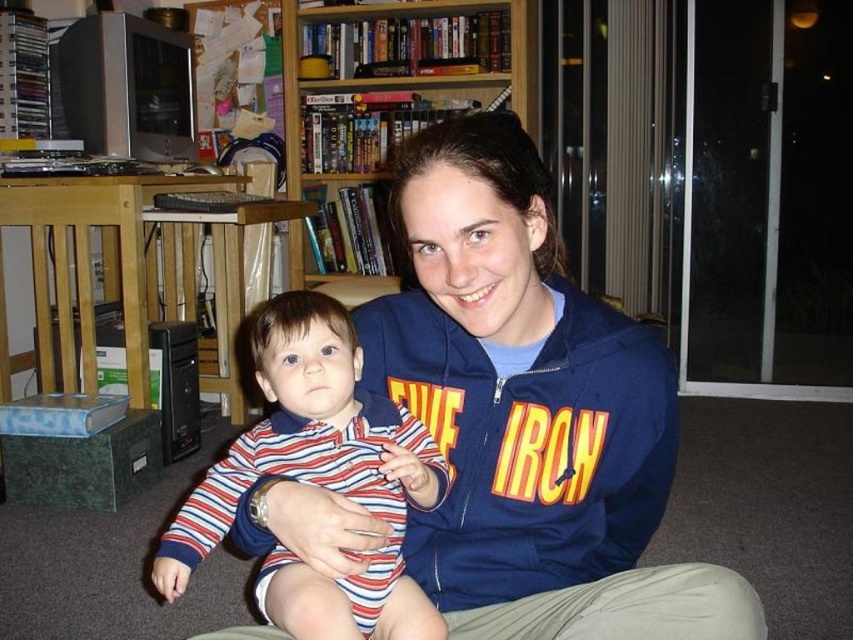
You are a tailor who needs to determine which clothing item requires more fabric based on their widths. The navy blue hoodie at center and the striped cotton onesie at center are both in front of you. Which one has a greater width?

The navy blue hoodie at center has a greater width than the striped cotton onesie at center according to the description.

You are a delivery person who needs to place a 2.5 meter long package between the navy blue hoodie at center and the wooden bookshelf at upper center. Is there enough space to fit the package without moving any items?

The distance between the navy blue hoodie at center and the wooden bookshelf at upper center is 2.15 meters. Since the package is 2.5 meters long, it is longer than the available space. Therefore, the package cannot be placed between them without moving items.